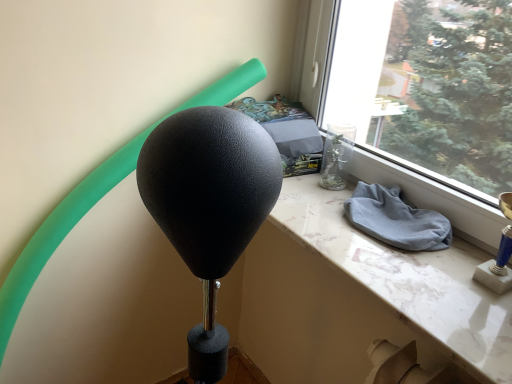
Question: Is white marble table at center closer to camera compared to gray cotton cloth at window sill?

Choices:
 (A) yes
 (B) no

Answer: (A)

Question: From a real-world perspective, is white marble table at center positioned under gray cotton cloth at window sill based on gravity?

Choices:
 (A) no
 (B) yes

Answer: (B)

Question: Is gray cotton cloth at window sill surrounded by white marble table at center?

Choices:
 (A) no
 (B) yes

Answer: (A)

Question: Can you confirm if white marble table at center is wider than gray cotton cloth at window sill?

Choices:
 (A) no
 (B) yes

Answer: (B)

Question: Does white marble table at center have a greater height compared to gray cotton cloth at window sill?

Choices:
 (A) yes
 (B) no

Answer: (B)

Question: Considering the relative positions of white marble table at center and gray cotton cloth at window sill in the image provided, is white marble table at center to the right of gray cotton cloth at window sill from the viewer's perspective?

Choices:
 (A) yes
 (B) no

Answer: (B)

Question: From the image's perspective, is gray cotton cloth at window sill on top of white marble table at center?

Choices:
 (A) yes
 (B) no

Answer: (A)

Question: Is the position of gray cotton cloth at window sill more distant than that of white marble table at center?

Choices:
 (A) yes
 (B) no

Answer: (A)

Question: Can you confirm if gray cotton cloth at window sill is positioned to the right of white marble table at center?

Choices:
 (A) yes
 (B) no

Answer: (A)

Question: From a real-world perspective, is gray cotton cloth at window sill positioned over white marble table at center based on gravity?

Choices:
 (A) no
 (B) yes

Answer: (B)

Question: Does gray cotton cloth at window sill have a lesser width compared to white marble table at center?

Choices:
 (A) no
 (B) yes

Answer: (B)

Question: Can you confirm if gray cotton cloth at window sill is bigger than white marble table at center?

Choices:
 (A) yes
 (B) no

Answer: (B)

Question: From a real-world perspective, is white marble table at center physically located above or below gray cotton cloth at window sill?

Choices:
 (A) above
 (B) below

Answer: (B)